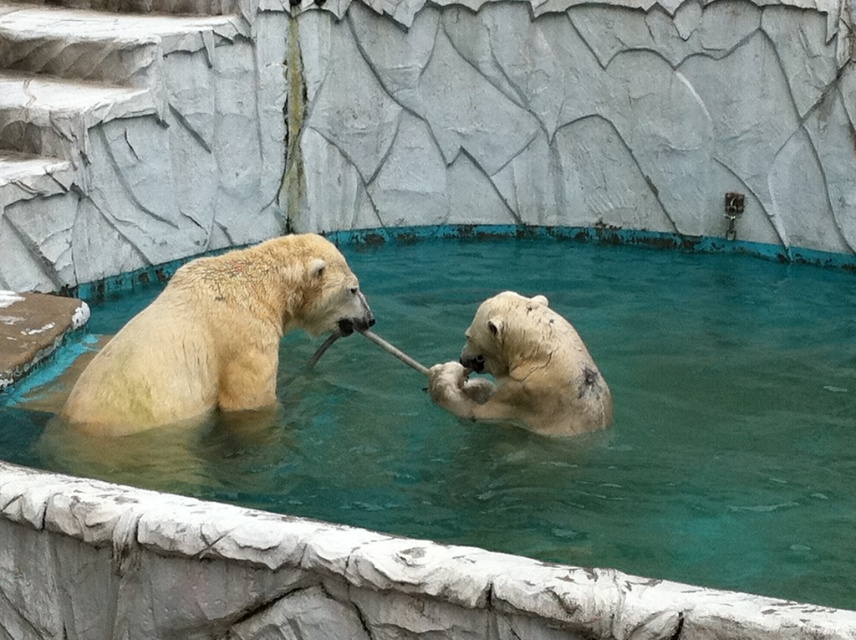
You are a zookeeper planning to distribute food to the bears in the pool. Since the clear blue water at center and the white fur bear at center are both in the pool, which one requires more space to accommodate their feeding area?

The clear blue water at center is larger in size than the white fur bear at center, so the feeding area for the clear blue water at center would need more space.

You are a zookeeper observing two polar bears in their pool. You notice two points marked in the image. The first point is at coordinates point (563, 268) and the second is at point (314, 307). Which point is closer to you, the zookeeper?

Point (563, 268) is further to the viewer than point (314, 307), so the point closer to you is point (314, 307).